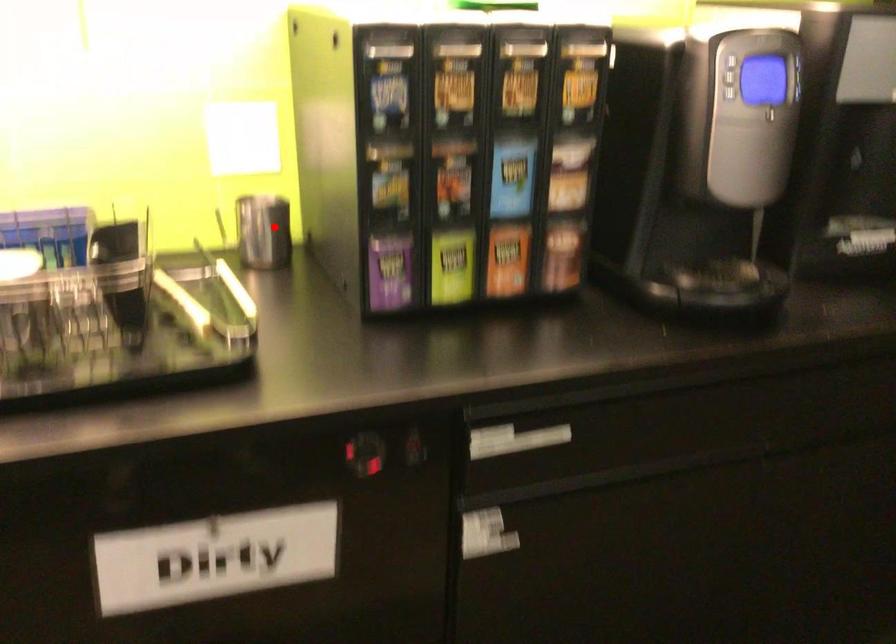
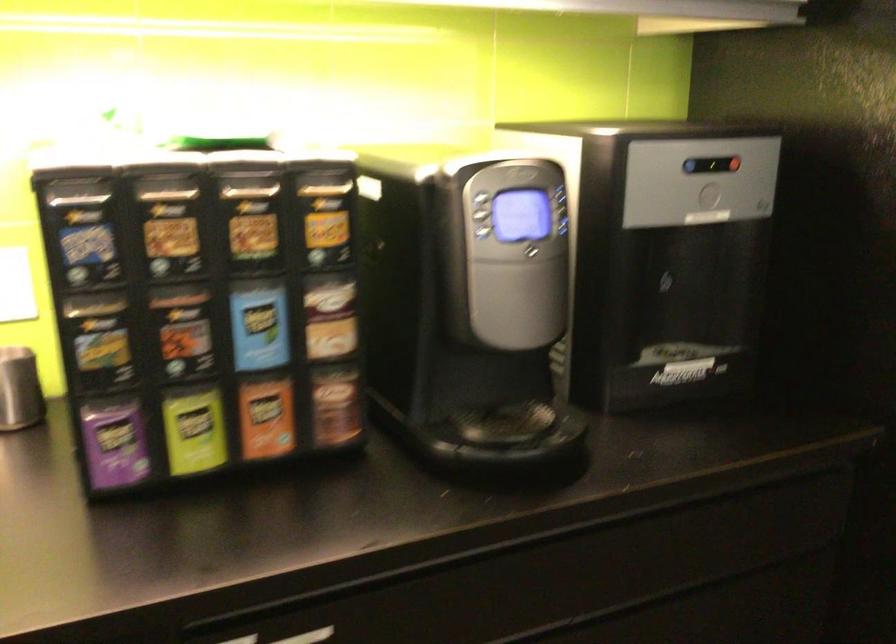
Question: I am providing you with two images of the same scene from different viewpoints. Given a red point in image1, look at the same physical point in image2. Is it:

Choices:
 (A) Closer to the viewpoint
 (B) Farther from the viewpoint

Answer: (A)